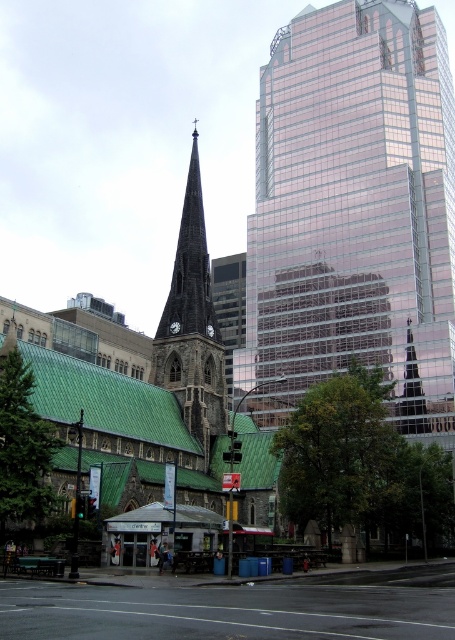
Based on the photo, you are standing at the center of the image and want to locate the green slate roof at center. According to the coordinates provided, in which direction should you look to find it?

The green slate roof at center is located at coordinates point (137, 396). Since the x coordinate is 0.620, which is greater than 0.5, you should look to the right from the center to find it.

You are standing in the middle of the street looking at the historic church with green roof on the left and the modern glass skyscraper at center. There is a point marked at coordinates (x=353, y=205). Which object does this point belong to?

The point at coordinates (x=353, y=205) is on the glassy reflective skyscraper at center.